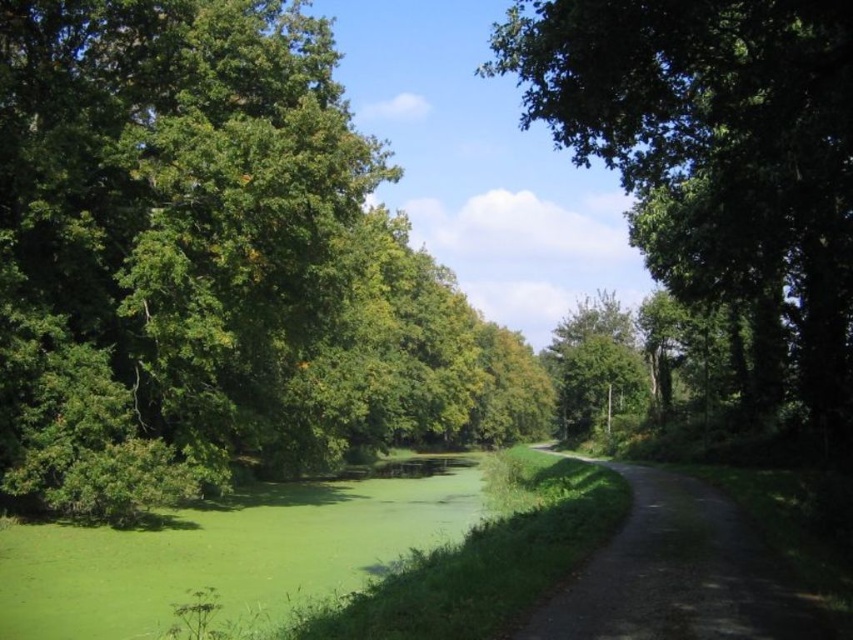
Between green leafy tree at left and green leafy tree at upper right, which one has less height?

Standing shorter between the two is green leafy tree at left.

Is point (74, 115) positioned after point (850, 362)?

No, it is in front of (850, 362).

You are a GUI agent. You are given a task and a screenshot of the screen. Output one action in this format:
    pyautogui.click(x=<x>, y=<y>)
    Task: Click on the green leafy tree at left
    
    Given the screenshot: What is the action you would take?
    pyautogui.click(x=213, y=266)

Based on the photo, does green leafy tree at left have a lesser width compared to green leafy tree at center?

Incorrect, green leafy tree at left's width is not less than green leafy tree at center's.

Is point (73, 125) behind point (595, 353)?

No.

Who is more distant from viewer, (434, 440) or (634, 332)?

The point (434, 440) is more distant.

This screenshot has width=853, height=640. Identify the location of green leafy tree at left. (213, 266).

Can you confirm if dirt/gravel path at right is taller than green leafy tree at center?

No, dirt/gravel path at right is not taller than green leafy tree at center.

Who is more distant from viewer, (784, 621) or (627, 314)?

Positioned behind is point (627, 314).

Who is more forward, (653,516) or (608,330)?

Point (653,516) is in front.

The image size is (853, 640). Identify the location of dirt/gravel path at right. (677, 573).